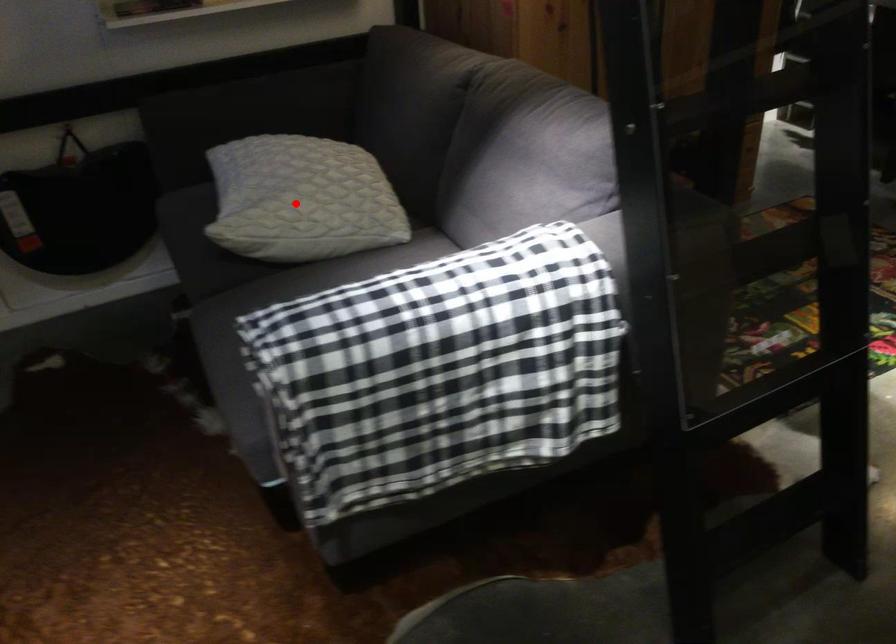
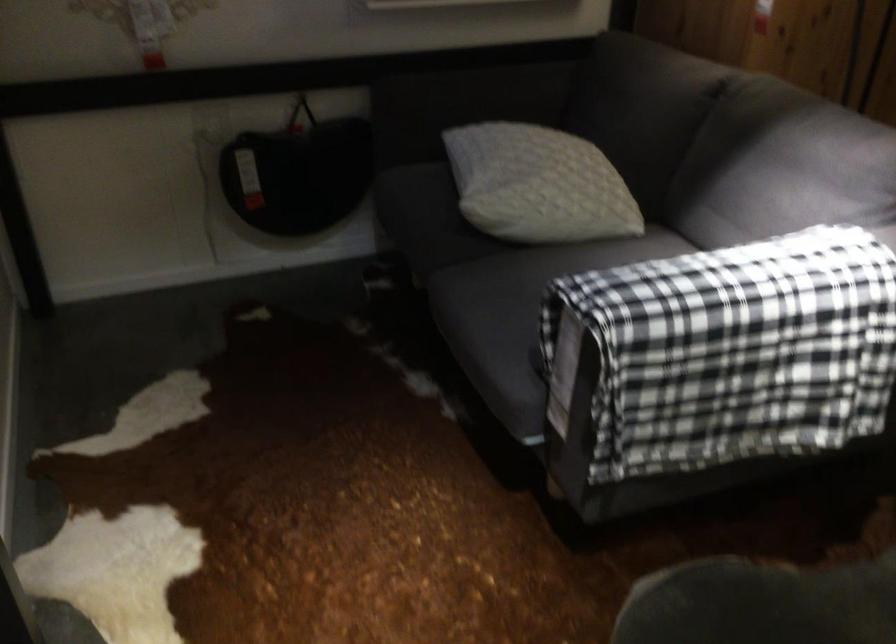
The point at the highlighted location is marked in the first image. Where is the corresponding point in the second image?

(538, 185)